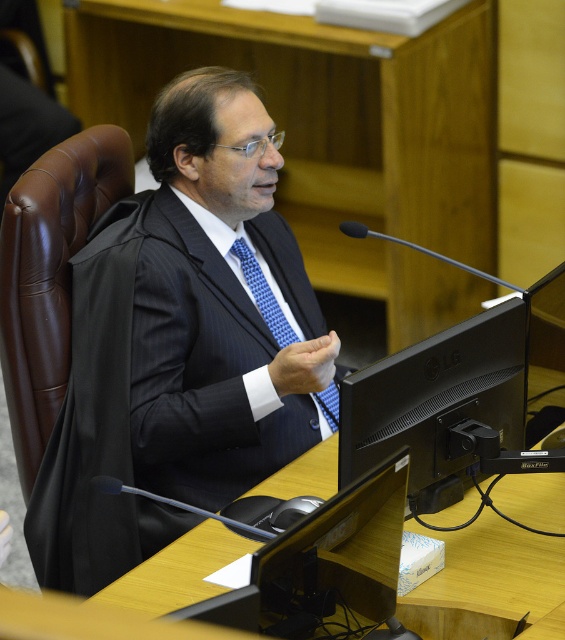
Question: Which of the following is the closest to the observer?

Choices:
 (A) (488, 531)
 (B) (179, 262)

Answer: (A)

Question: Is dark blue suit at center further to camera compared to black glossy monitor at center?

Choices:
 (A) yes
 (B) no

Answer: (A)

Question: Among these objects, which one is farthest from the camera?

Choices:
 (A) blue textured tie at center
 (B) black glossy monitor at center
 (C) dark blue suit at center
 (D) wooden table at center

Answer: (A)

Question: Is wooden table at center bigger than blue textured tie at center?

Choices:
 (A) no
 (B) yes

Answer: (B)

Question: Which of the following is the closest to the observer?

Choices:
 (A) (537, 589)
 (B) (399, 394)
 (C) (332, 406)
 (D) (241, 193)

Answer: (A)

Question: Is black glossy monitor at center above blue textured tie at center?

Choices:
 (A) yes
 (B) no

Answer: (B)